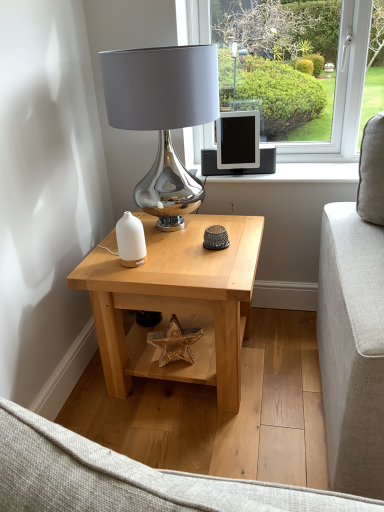
Locate an element on the screen. This screenshot has width=384, height=512. free spot to the right of white glossy candle holder at center is located at coordinates (177, 262).